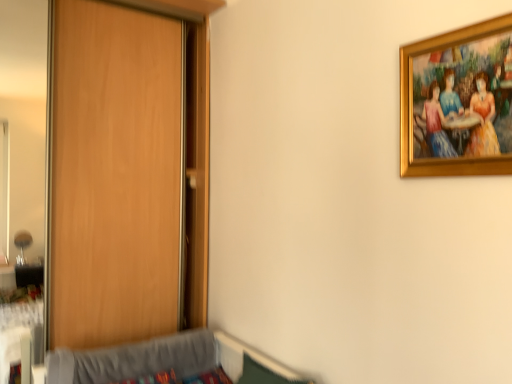
At what (x,y) coordinates should I click in order to perform the action: click on wooden door at left. Please return your answer as a coordinate pair (x, y). This screenshot has height=384, width=512. Looking at the image, I should click on (127, 170).

Where is `gray fabric hospital bed at lower left`? Image resolution: width=512 pixels, height=384 pixels. gray fabric hospital bed at lower left is located at coordinates (169, 361).

Is wooden door at left facing towards gold-framed painting at upper right?

Yes, wooden door at left is aimed at gold-framed painting at upper right.

From the picture: Does wooden door at left have a larger size compared to gold-framed painting at upper right?

Yes.

Considering the positions of objects wooden door at left and gold-framed painting at upper right in the image provided, who is more to the left, wooden door at left or gold-framed painting at upper right?

wooden door at left is more to the left.

From a real-world perspective, is wooden door at left above or below gold-framed painting at upper right?

In terms of real-world spatial position, wooden door at left is below gold-framed painting at upper right.

Is point (81, 344) in front of point (270, 369)?

No, it is behind (270, 369).

From the picture: Does wooden door at left have a lesser width compared to gray fabric hospital bed at lower left?

Correct, the width of wooden door at left is less than that of gray fabric hospital bed at lower left.

Is gray fabric hospital bed at lower left located within wooden door at left?

No, gray fabric hospital bed at lower left is not a part of wooden door at left.

From the image's perspective, is wooden door at left positioned above or below gray fabric hospital bed at lower left?

Clearly, from the image's perspective, wooden door at left is above gray fabric hospital bed at lower left.

Could you tell me if gold-framed painting at upper right is facing wooden door at left?

No, gold-framed painting at upper right is not turned towards wooden door at left.

Looking at the image, does gold-framed painting at upper right seem bigger or smaller compared to wooden door at left?

Considering their sizes, gold-framed painting at upper right takes up less space than wooden door at left.

Is gold-framed painting at upper right wider or thinner than wooden door at left?

Clearly, gold-framed painting at upper right has less width compared to wooden door at left.

In order to click on door below the gold-framed painting at upper right (from the image's perspective) in this screenshot , I will do `click(127, 170)`.

Based on their positions, is gold-framed painting at upper right located to the left or right of gray fabric hospital bed at lower left?

Clearly, gold-framed painting at upper right is on the right of gray fabric hospital bed at lower left in the image.

Which object is closer to the camera taking this photo, gold-framed painting at upper right or gray fabric hospital bed at lower left?

Positioned in front is gold-framed painting at upper right.

Does gold-framed painting at upper right have a larger size compared to gray fabric hospital bed at lower left?

No.

Is gray fabric hospital bed at lower left smaller than gold-framed painting at upper right?

Actually, gray fabric hospital bed at lower left might be larger than gold-framed painting at upper right.

Is gray fabric hospital bed at lower left further to the viewer compared to gold-framed painting at upper right?

Yes, gray fabric hospital bed at lower left is further from the camera.

Would you consider gray fabric hospital bed at lower left to be distant from gold-framed painting at upper right?

gray fabric hospital bed at lower left is positioned a significant distance from gold-framed painting at upper right.

Considering the relative positions of gray fabric hospital bed at lower left and gold-framed painting at upper right in the image provided, is gray fabric hospital bed at lower left to the left or to the right of gold-framed painting at upper right?

Based on their positions, gray fabric hospital bed at lower left is located to the left of gold-framed painting at upper right.

Based on their sizes in the image, would you say gray fabric hospital bed at lower left is bigger or smaller than wooden door at left?

gray fabric hospital bed at lower left is smaller than wooden door at left.

How many degrees apart are the facing directions of gray fabric hospital bed at lower left and wooden door at left?

gray fabric hospital bed at lower left and wooden door at left are facing 102 degrees away from each other.

Which is behind, point (242, 356) or point (160, 295)?

Positioned behind is point (160, 295).

Which is more to the left, gray fabric hospital bed at lower left or wooden door at left?

From the viewer's perspective, wooden door at left appears more on the left side.

Where is `picture frame above the wooden door at left (from a real-world perspective)`? The width and height of the screenshot is (512, 384). picture frame above the wooden door at left (from a real-world perspective) is located at coordinates (458, 102).

Where is `hospital bed below the wooden door at left (from a real-world perspective)`? hospital bed below the wooden door at left (from a real-world perspective) is located at coordinates (169, 361).

Based on their spatial positions, is gray fabric hospital bed at lower left or wooden door at left closer to gold-framed painting at upper right?

Based on the image, gray fabric hospital bed at lower left appears to be nearer to gold-framed painting at upper right.

Considering their positions, is gray fabric hospital bed at lower left positioned closer to wooden door at left than gold-framed painting at upper right?

Among the two, gray fabric hospital bed at lower left is located nearer to wooden door at left.

Estimate the real-world distances between objects in this image. Which object is further from wooden door at left, gold-framed painting at upper right or gray fabric hospital bed at lower left?

A: The object further to wooden door at left is gold-framed painting at upper right.

Which object lies nearer to the anchor point gray fabric hospital bed at lower left, wooden door at left or gold-framed painting at upper right?

wooden door at left is positioned closer to the anchor gray fabric hospital bed at lower left.

When comparing their distances from gray fabric hospital bed at lower left, does gold-framed painting at upper right or wooden door at left seem further?

gold-framed painting at upper right.

Looking at the image, which one is located closer to gold-framed painting at upper right, wooden door at left or gray fabric hospital bed at lower left?

gray fabric hospital bed at lower left is positioned closer to the anchor gold-framed painting at upper right.

This screenshot has width=512, height=384. In order to click on hospital bed between wooden door at left and gold-framed painting at upper right in the horizontal direction in this screenshot , I will do pyautogui.click(x=169, y=361).